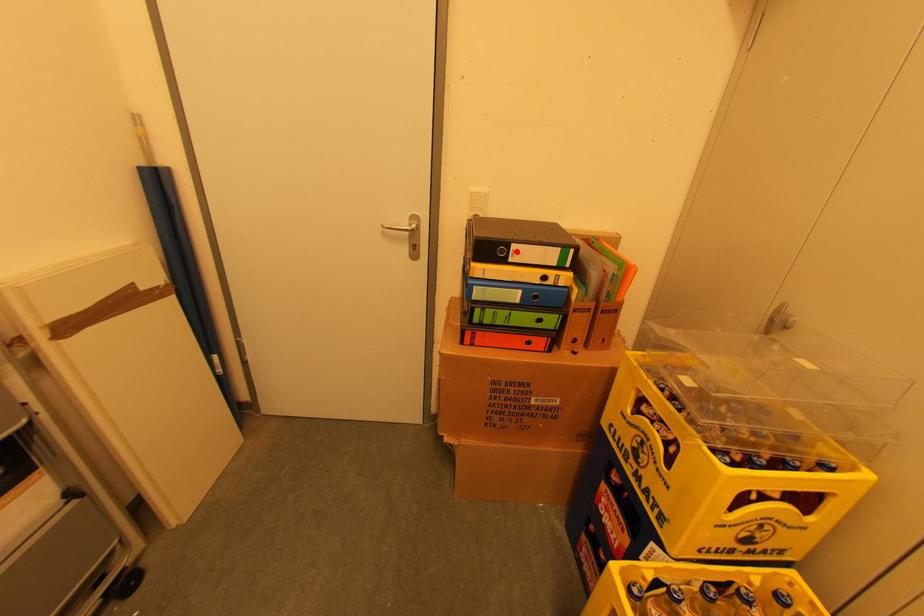
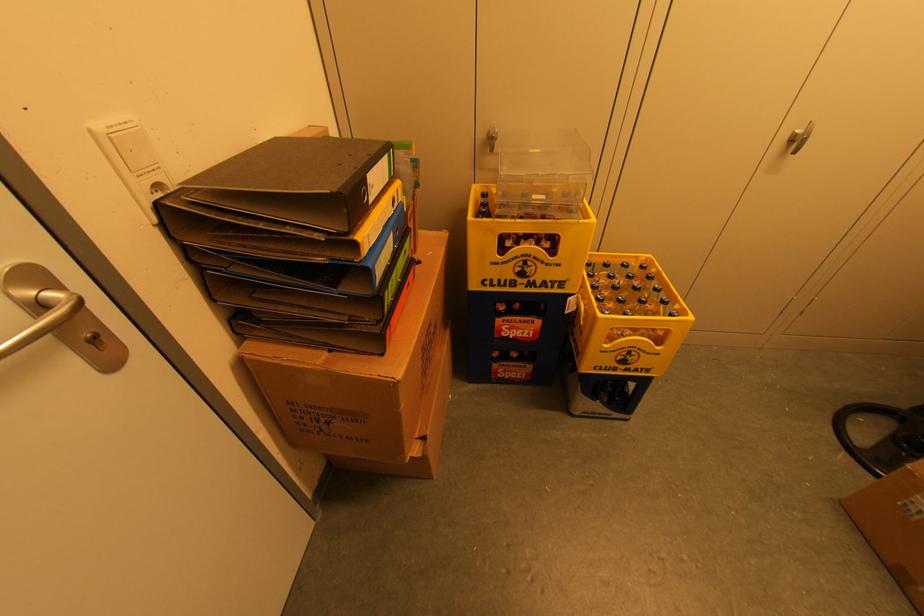
In the second image, find the point that corresponds to the highlighted location in the first image.

(371, 185)